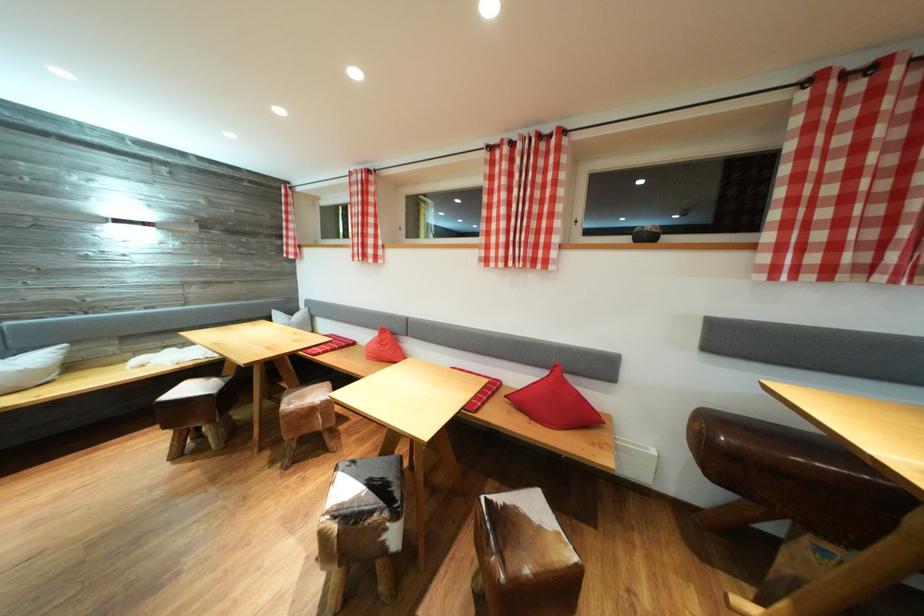
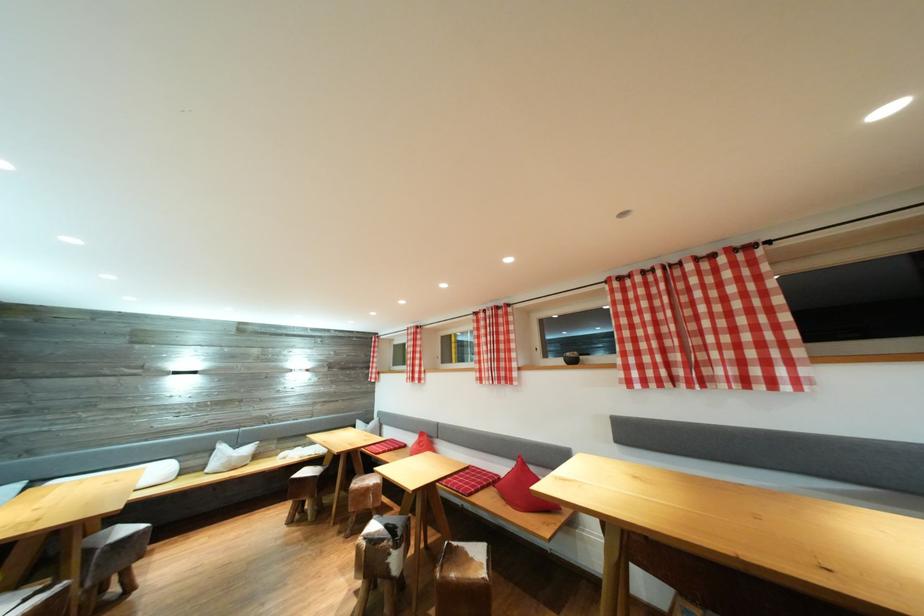
The point at (869, 66) is marked in the first image. Where is the corresponding point in the second image?

(631, 278)